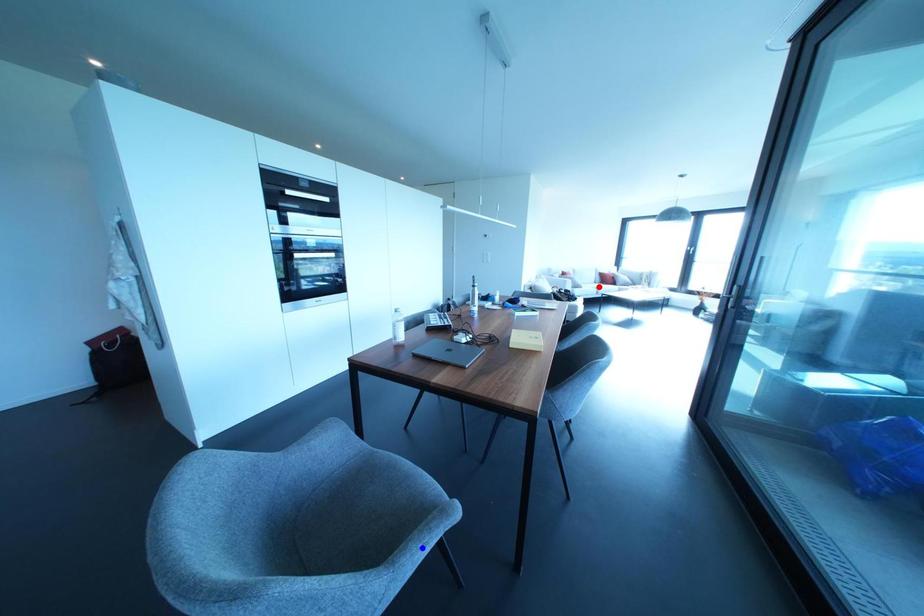
Question: In the image, two points are highlighted. Which point is nearer to the camera? Reply with the corresponding letter.

Choices:
 (A) blue point
 (B) red point

Answer: (A)